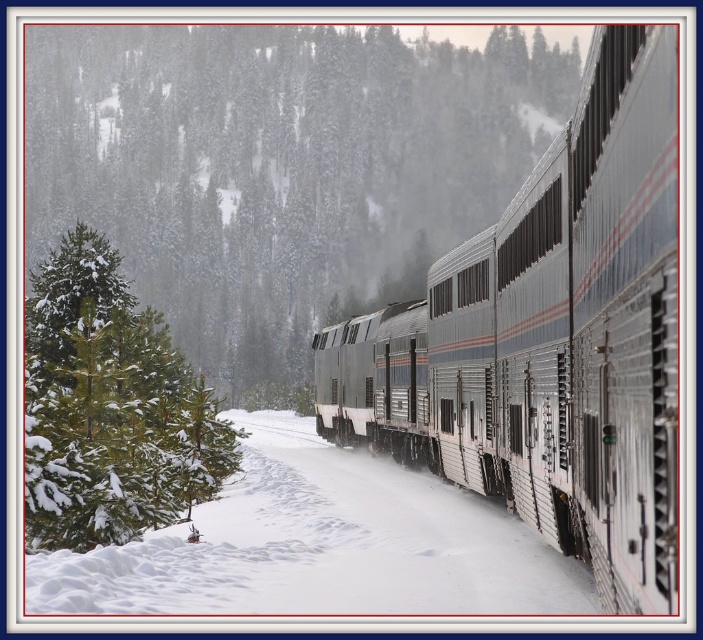
Question: Is green matte tree at left to the right of green matte evergreen tree at left from the viewer's perspective?

Choices:
 (A) no
 (B) yes

Answer: (B)

Question: Can you confirm if green matte tree at left is smaller than white powdery snow at lower center?

Choices:
 (A) yes
 (B) no

Answer: (B)

Question: Which point is farther from the camera taking this photo?

Choices:
 (A) (264, 61)
 (B) (39, 576)
 (C) (520, 506)

Answer: (A)

Question: Among these points, which one is farthest from the camera?

Choices:
 (A) (393, 513)
 (B) (671, 593)

Answer: (A)

Question: Considering the real-world distances, which object is farthest from the green matte tree at left?

Choices:
 (A) white powdery snow at lower center
 (B) green matte evergreen tree at left
 (C) silver metallic train at right

Answer: (A)

Question: Is green matte tree at left further to camera compared to silver metallic train at right?

Choices:
 (A) no
 (B) yes

Answer: (B)